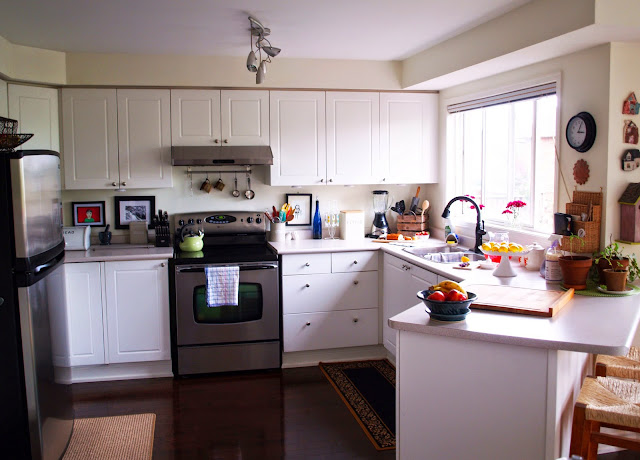
I want to click on stove, so click(x=230, y=245).